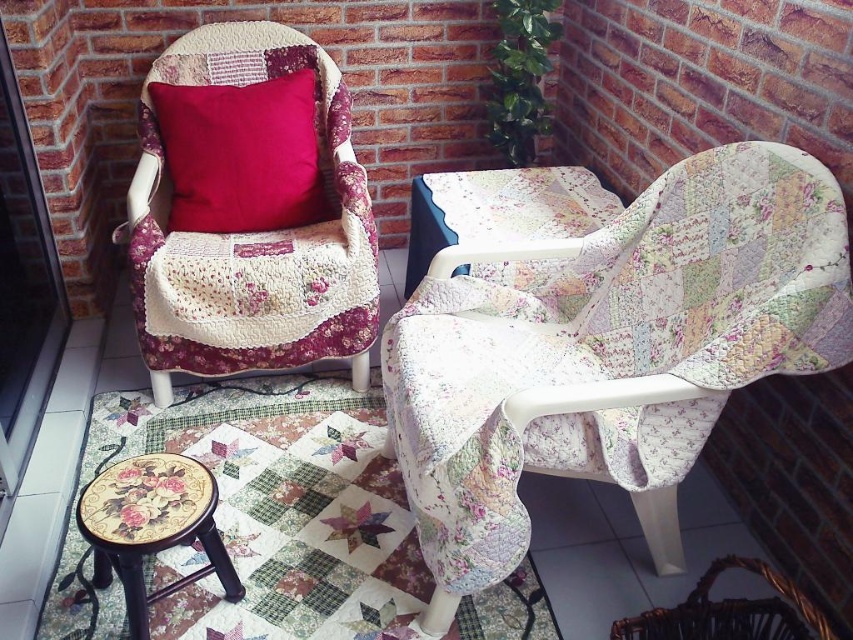
Consider the image. You are standing in the cozy corner described. There is a point marked at coordinates [612,346]. Which object does this point belong to?

The point at coordinates [612,346] is on the floral patchwork armchair at center.

You are sitting on the floral fabric stool at lower left and want to reach the floral patchwork armchair at center. Which direction should you move to get there?

You should move to the right to reach the floral patchwork armchair at center since it is located to the right of the floral fabric stool at lower left.